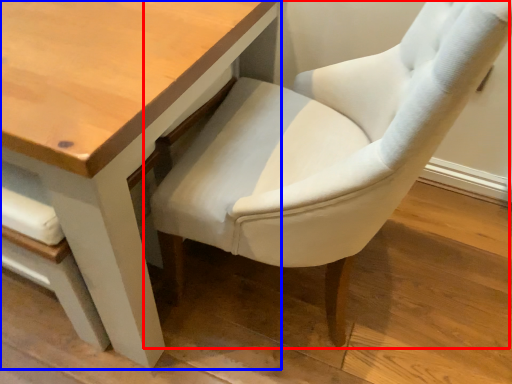
Question: Which of the following is the farthest to the observer, chair (highlighted by a red box) or table (highlighted by a blue box)?

Choices:
 (A) chair
 (B) table

Answer: (B)